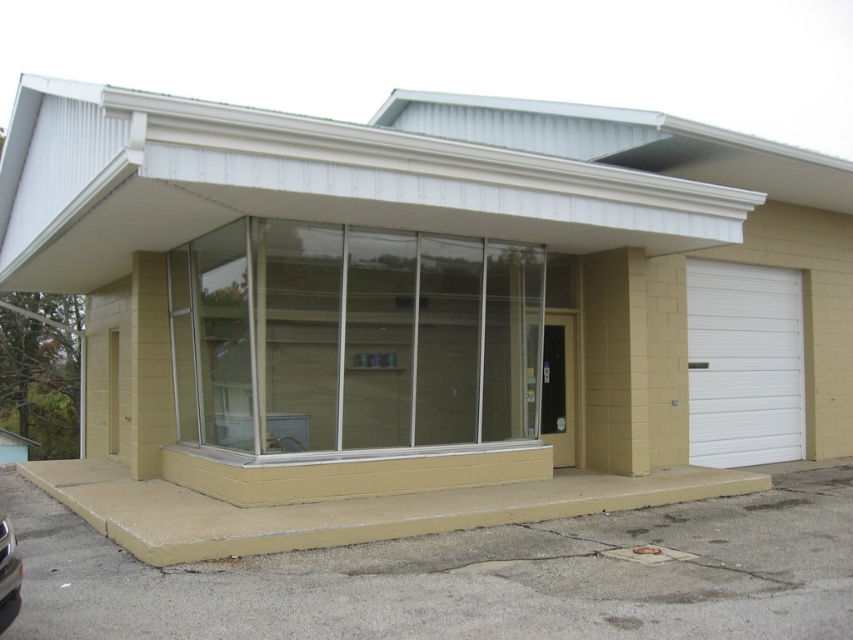
Question: Which point is farther to the camera?

Choices:
 (A) transparent glass windows at center
 (B) white smooth garage door at right

Answer: (B)

Question: Which point is farther to the camera?

Choices:
 (A) shiny silver car at lower left
 (B) white smooth garage door at right

Answer: (B)

Question: Does transparent glass windows at center have a larger size compared to white smooth garage door at right?

Choices:
 (A) no
 (B) yes

Answer: (A)

Question: Does transparent glass windows at center appear over white smooth garage door at right?

Choices:
 (A) yes
 (B) no

Answer: (A)

Question: Observing the image, what is the correct spatial positioning of transparent glass windows at center in reference to white smooth garage door at right?

Choices:
 (A) left
 (B) right

Answer: (A)

Question: Which point appears closest to the camera in this image?

Choices:
 (A) (724, 291)
 (B) (318, 257)

Answer: (B)